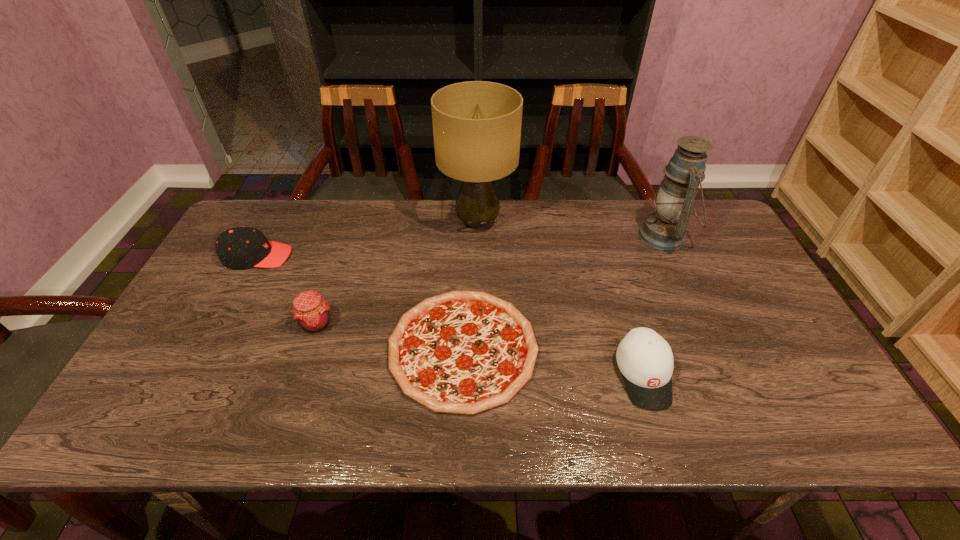
Where is `object located at the far left corner`? object located at the far left corner is located at coordinates (240, 247).

I want to click on object located in the far right corner section of the desktop, so click(665, 229).

Where is `vacant space at the far edge`? The height and width of the screenshot is (540, 960). vacant space at the far edge is located at coordinates (488, 240).

In the image, there is a desktop. Find the location of `vacant space at the near edge`. vacant space at the near edge is located at coordinates (706, 408).

In the image, there is a desktop. What are the coordinates of `vacant space at the left edge` in the screenshot? It's located at (210, 342).

Identify the location of vacant space at the right edge of the desktop. Image resolution: width=960 pixels, height=540 pixels. (722, 309).

Locate an element on the screen. The height and width of the screenshot is (540, 960). vacant space at the far left corner of the desktop is located at coordinates (281, 225).

At what (x,y) coordinates should I click in order to perform the action: click on blank space at the far right corner. Please return your answer as a coordinate pair (x, y). Looking at the image, I should click on (708, 240).

Locate an element on the screen. The height and width of the screenshot is (540, 960). free space between the cap and the lampshade is located at coordinates (368, 239).

Find the location of `free space between the rightmost object and the fifth object from right to left`. free space between the rightmost object and the fifth object from right to left is located at coordinates (491, 280).